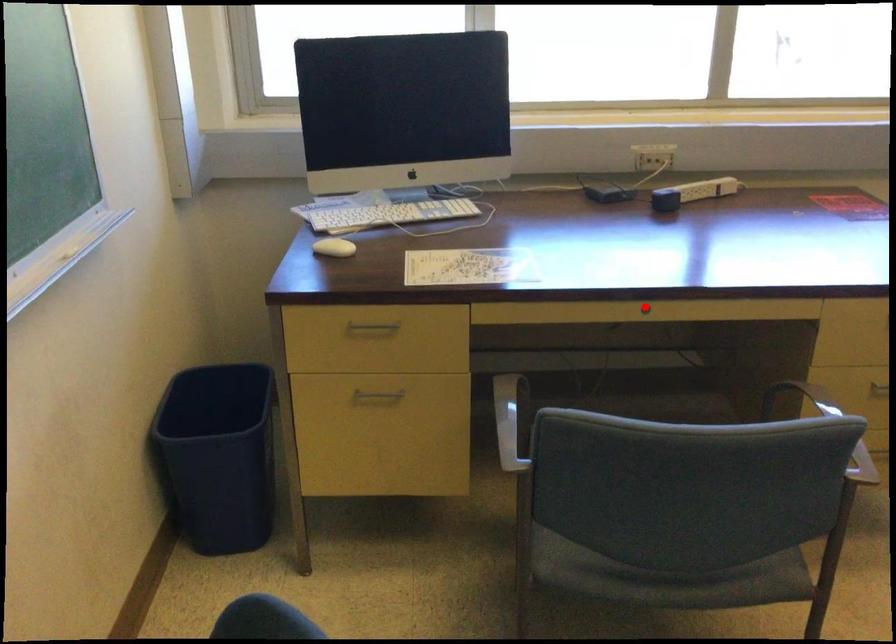
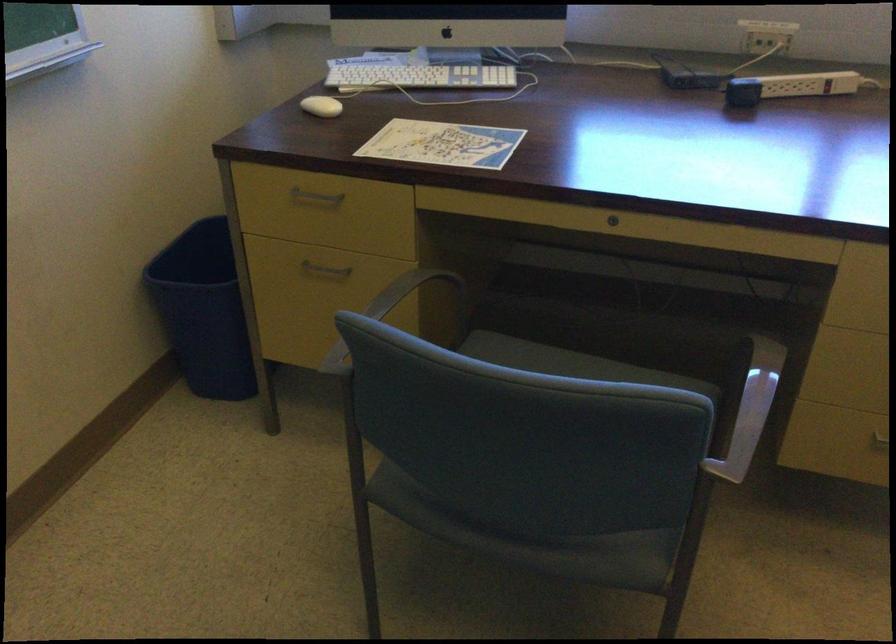
Question: A red point is marked in image1. In image2, is the corresponding 3D point closer to the camera or farther? Reply with the corresponding letter.

Choices:
 (A) The corresponding 3D point is closer.
 (B) The corresponding 3D point is farther.

Answer: (A)